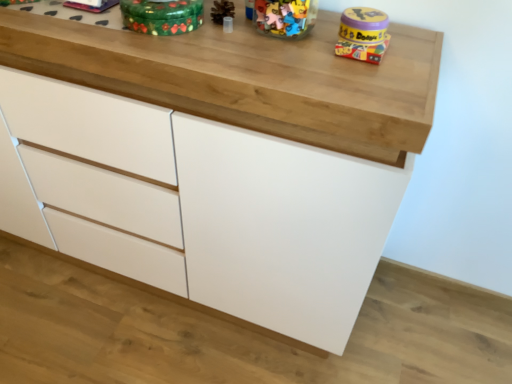
You are a GUI agent. You are given a task and a screenshot of the screen. Output one action in this format:
    pyautogui.click(x=<x>, y=<y>)
    Task: Click on the green painted wood toy at upper center, which ranks as the first toy in left-to-right order
    The width and height of the screenshot is (512, 384).
    Given the screenshot: What is the action you would take?
    pyautogui.click(x=162, y=16)

Looking at this image, what is the approximate width of green painted wood toy at upper center, acting as the 2th toy starting from the right?

green painted wood toy at upper center, acting as the 2th toy starting from the right, is 7.07 inches in width.

What do you see at coordinates (162, 16) in the screenshot? I see `green painted wood toy at upper center, which ranks as the first toy in left-to-right order` at bounding box center [162, 16].

The image size is (512, 384). What do you see at coordinates (362, 34) in the screenshot? I see `matte yellow plastic toy at upper right, the first toy when ordered from right to left` at bounding box center [362, 34].

Find the location of a particular element. matte yellow plastic toy at upper right, the first toy when ordered from right to left is located at coordinates pyautogui.click(x=362, y=34).

Where is `green painted wood toy at upper center, acting as the 2th toy starting from the right`? The image size is (512, 384). green painted wood toy at upper center, acting as the 2th toy starting from the right is located at coordinates (162, 16).

Considering the positions of objects green painted wood toy at upper center, acting as the 2th toy starting from the right, and matte yellow plastic toy at upper right, the first toy when ordered from right to left, in the image provided, who is more to the left, green painted wood toy at upper center, acting as the 2th toy starting from the right, or matte yellow plastic toy at upper right, the first toy when ordered from right to left,?

From the viewer's perspective, green painted wood toy at upper center, acting as the 2th toy starting from the right, appears more on the left side.

Which object is further away from the camera taking this photo, green painted wood toy at upper center, which ranks as the first toy in left-to-right order, or matte yellow plastic toy at upper right, the first toy when ordered from right to left?

matte yellow plastic toy at upper right, the first toy when ordered from right to left, is behind.

Is point (154, 11) positioned before point (372, 22)?

No.

From the image's perspective, is green painted wood toy at upper center, acting as the 2th toy starting from the right, under matte yellow plastic toy at upper right, the first toy when ordered from right to left?

No, from the image's perspective, green painted wood toy at upper center, acting as the 2th toy starting from the right, is not below matte yellow plastic toy at upper right, the first toy when ordered from right to left.

From a real-world perspective, who is located higher, green painted wood toy at upper center, acting as the 2th toy starting from the right, or matte yellow plastic toy at upper right, arranged as the 2th toy when viewed from the left?

green painted wood toy at upper center, acting as the 2th toy starting from the right.

Which of these two, green painted wood toy at upper center, acting as the 2th toy starting from the right, or matte yellow plastic toy at upper right, arranged as the 2th toy when viewed from the left, is thinner?

matte yellow plastic toy at upper right, arranged as the 2th toy when viewed from the left, is thinner.

In the scene shown: Is green painted wood toy at upper center, acting as the 2th toy starting from the right, taller than matte yellow plastic toy at upper right, arranged as the 2th toy when viewed from the left?

Correct, green painted wood toy at upper center, acting as the 2th toy starting from the right, is much taller as matte yellow plastic toy at upper right, arranged as the 2th toy when viewed from the left.

Does green painted wood toy at upper center, which ranks as the first toy in left-to-right order, have a larger size compared to matte yellow plastic toy at upper right, arranged as the 2th toy when viewed from the left?

Yes.

Is green painted wood toy at upper center, acting as the 2th toy starting from the right, not within matte yellow plastic toy at upper right, the first toy when ordered from right to left?

Yes.

Is green painted wood toy at upper center, acting as the 2th toy starting from the right, far from matte yellow plastic toy at upper right, the first toy when ordered from right to left?

green painted wood toy at upper center, acting as the 2th toy starting from the right, is actually quite close to matte yellow plastic toy at upper right, the first toy when ordered from right to left.

Is green painted wood toy at upper center, which ranks as the first toy in left-to-right order, looking in the opposite direction of matte yellow plastic toy at upper right, the first toy when ordered from right to left?

No, matte yellow plastic toy at upper right, the first toy when ordered from right to left, is not at the back of green painted wood toy at upper center, which ranks as the first toy in left-to-right order.

Can you tell me how much green painted wood toy at upper center, acting as the 2th toy starting from the right, and matte yellow plastic toy at upper right, the first toy when ordered from right to left, differ in facing direction?

1.97 degrees.

I want to click on toy to the right of green painted wood toy at upper center, which ranks as the first toy in left-to-right order, so click(x=362, y=34).

Is matte yellow plastic toy at upper right, arranged as the 2th toy when viewed from the left, at the left side of green painted wood toy at upper center, acting as the 2th toy starting from the right?

No, matte yellow plastic toy at upper right, arranged as the 2th toy when viewed from the left, is not to the left of green painted wood toy at upper center, acting as the 2th toy starting from the right.

Which is behind, matte yellow plastic toy at upper right, the first toy when ordered from right to left, or green painted wood toy at upper center, which ranks as the first toy in left-to-right order?

matte yellow plastic toy at upper right, the first toy when ordered from right to left, is further away from the camera.

Which is closer, (366, 38) or (166, 16)?

Point (366, 38).

From the image's perspective, is matte yellow plastic toy at upper right, arranged as the 2th toy when viewed from the left, beneath green painted wood toy at upper center, which ranks as the first toy in left-to-right order?

Indeed, from the image's perspective, matte yellow plastic toy at upper right, arranged as the 2th toy when viewed from the left, is shown beneath green painted wood toy at upper center, which ranks as the first toy in left-to-right order.

From a real-world perspective, which object rests below the other?

matte yellow plastic toy at upper right, arranged as the 2th toy when viewed from the left.

Which object is thinner, matte yellow plastic toy at upper right, arranged as the 2th toy when viewed from the left, or green painted wood toy at upper center, acting as the 2th toy starting from the right?

With smaller width is matte yellow plastic toy at upper right, arranged as the 2th toy when viewed from the left.

Is matte yellow plastic toy at upper right, the first toy when ordered from right to left, taller or shorter than green painted wood toy at upper center, acting as the 2th toy starting from the right?

In the image, matte yellow plastic toy at upper right, the first toy when ordered from right to left, appears to be shorter than green painted wood toy at upper center, acting as the 2th toy starting from the right.

Which of these two, matte yellow plastic toy at upper right, arranged as the 2th toy when viewed from the left, or green painted wood toy at upper center, acting as the 2th toy starting from the right, is bigger?

With larger size is green painted wood toy at upper center, acting as the 2th toy starting from the right.

Looking at this image, can green painted wood toy at upper center, acting as the 2th toy starting from the right, be found inside matte yellow plastic toy at upper right, arranged as the 2th toy when viewed from the left?

No, green painted wood toy at upper center, acting as the 2th toy starting from the right, is not a part of matte yellow plastic toy at upper right, arranged as the 2th toy when viewed from the left.

Are matte yellow plastic toy at upper right, the first toy when ordered from right to left, and green painted wood toy at upper center, acting as the 2th toy starting from the right, located far from each other?

No.

Is matte yellow plastic toy at upper right, arranged as the 2th toy when viewed from the left, looking in the opposite direction of green painted wood toy at upper center, acting as the 2th toy starting from the right?

matte yellow plastic toy at upper right, arranged as the 2th toy when viewed from the left, does not have its back to green painted wood toy at upper center, acting as the 2th toy starting from the right.

How different are the orientations of matte yellow plastic toy at upper right, the first toy when ordered from right to left, and green painted wood toy at upper center, acting as the 2th toy starting from the right, in degrees?

There is a 1.97-degree angle between the facing directions of matte yellow plastic toy at upper right, the first toy when ordered from right to left, and green painted wood toy at upper center, acting as the 2th toy starting from the right.

The height and width of the screenshot is (384, 512). I want to click on toy on the right of green painted wood toy at upper center, acting as the 2th toy starting from the right, so click(362, 34).

Identify the location of toy lying on the right of green painted wood toy at upper center, acting as the 2th toy starting from the right. This screenshot has width=512, height=384. (362, 34).

Find the location of a particular element. The width and height of the screenshot is (512, 384). toy to the left of matte yellow plastic toy at upper right, the first toy when ordered from right to left is located at coordinates (162, 16).